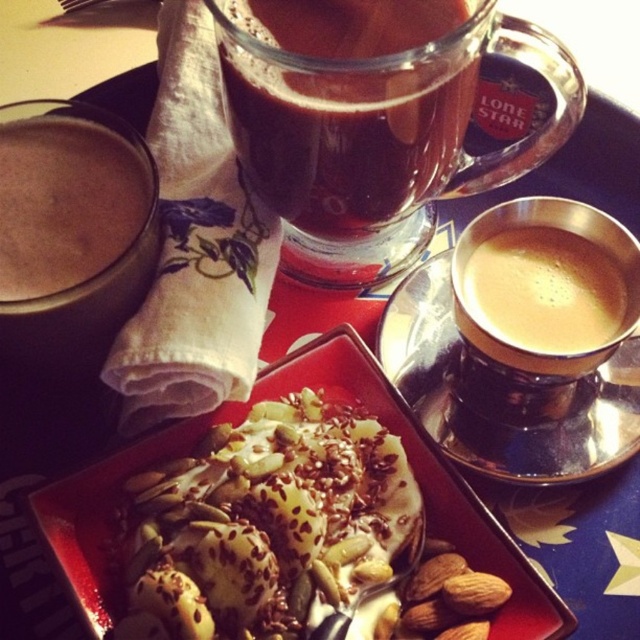
You are setting up a table for a guest and have a white creamy dessert at center and a matte brown coffee at left. According to the image, which item is placed to the right of the other?

The white creamy dessert at center is positioned on the right side of matte brown coffee at left, so the dessert is to the right of the coffee.

You are holding a spoon that is 25 centimeters long. If you want to reach the point at coordinates point (x=280, y=150) on the dark blue tray with a star pattern, can your spoon reach it?

The point (x=280, y=150) is 28.68 centimeters away from the viewer. Since the spoon is only 25 centimeters long, it cannot reach that point.

You are setting up a table for two guests. You have a white creamy dessert at center and a matte brown coffee at left. Which item should you place closer to the edge of the table to ensure both fit comfortably?

Since the white creamy dessert at center is wider than the matte brown coffee at left, you should place the matte brown coffee at left closer to the edge of the table to accommodate the dessert comfortably.